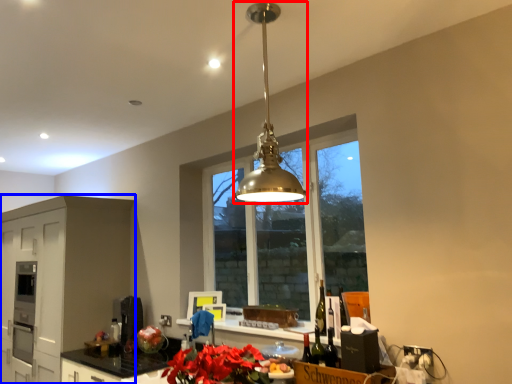
Question: Which object appears closest to the camera in this image, light fixture (highlighted by a red box) or cabinetry (highlighted by a blue box)?

Choices:
 (A) light fixture
 (B) cabinetry

Answer: (A)